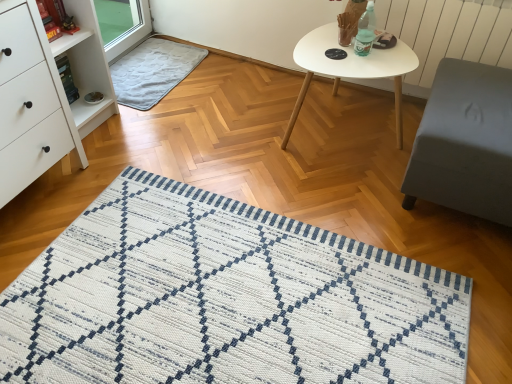
Image resolution: width=512 pixels, height=384 pixels. Find the location of `gray matte ottoman at right`. gray matte ottoman at right is located at coordinates (465, 142).

This screenshot has width=512, height=384. I want to click on white matte chest of drawers at left, so click(x=30, y=102).

What do you see at coordinates (30, 102) in the screenshot? I see `white matte chest of drawers at left` at bounding box center [30, 102].

Find the location of a particular element. The width and height of the screenshot is (512, 384). gray matte ottoman at right is located at coordinates (465, 142).

Does gray soft rug at upper left lie in front of white matte oval table at upper center?

No, it is behind white matte oval table at upper center.

Is gray soft rug at upper left to the left of white matte oval table at upper center from the viewer's perspective?

Correct, you'll find gray soft rug at upper left to the left of white matte oval table at upper center.

What's the angular difference between gray soft rug at upper left and white matte oval table at upper center's facing directions?

There is a 92.1-degree angle between the facing directions of gray soft rug at upper left and white matte oval table at upper center.

Is gray soft rug at upper left wider than white matte oval table at upper center?

Incorrect, the width of gray soft rug at upper left does not surpass that of white matte oval table at upper center.

Can you tell me how much translucent plastic bottle at upper right and white matte oval table at upper center differ in facing direction?

The facing directions of translucent plastic bottle at upper right and white matte oval table at upper center are 1.2 degrees apart.

Is translucent plastic bottle at upper right in front of white matte oval table at upper center?

No, translucent plastic bottle at upper right is further to the viewer.

What are the coordinates of `bottle above the white matte oval table at upper center (from the image's perspective)` in the screenshot? It's located at (365, 31).

From the image's perspective, would you say translucent plastic bottle at upper right is positioned over white matte oval table at upper center?

Yes, from the image's perspective, translucent plastic bottle at upper right is above white matte oval table at upper center.

Based on the photo, considering the relative sizes of white textured radiator at upper right and gray soft rug at upper left in the image provided, is white textured radiator at upper right shorter than gray soft rug at upper left?

No, white textured radiator at upper right is not shorter than gray soft rug at upper left.

From the image's perspective, which one is positioned higher, white textured radiator at upper right or gray soft rug at upper left?

gray soft rug at upper left appears higher in the image.

Looking at this image, is white textured radiator at upper right oriented away from gray soft rug at upper left?

white textured radiator at upper right is not turned away from gray soft rug at upper left.

Is white textured radiator at upper right placed right next to gray soft rug at upper left?

No, white textured radiator at upper right is not in contact with gray soft rug at upper left.

Between white textured radiator at upper right and gray matte ottoman at right, which one has less height?

white textured radiator at upper right is shorter.

Which object is positioned more to the right, white textured radiator at upper right or gray matte ottoman at right?

Positioned to the right is gray matte ottoman at right.

From a real-world perspective, who is located lower, white textured radiator at upper right or gray matte ottoman at right?

white textured radiator at upper right, from a real-world perspective.

From a real-world perspective, which is physically above, gray matte ottoman at right or gray soft rug at upper left?

gray matte ottoman at right.

Can you confirm if gray matte ottoman at right is bigger than gray soft rug at upper left?

Yes.

Is gray matte ottoman at right directly adjacent to gray soft rug at upper left?

No, gray matte ottoman at right is not beside gray soft rug at upper left.

From the image's perspective, between white matte chest of drawers at left and translucent plastic bottle at upper right, which one is located above?

translucent plastic bottle at upper right.

Could you measure the distance between white matte chest of drawers at left and translucent plastic bottle at upper right?

white matte chest of drawers at left and translucent plastic bottle at upper right are 1.39 meters apart from each other.

Is white matte chest of drawers at left to the right of translucent plastic bottle at upper right from the viewer's perspective?

No, white matte chest of drawers at left is not to the right of translucent plastic bottle at upper right.

Is white matte chest of drawers at left touching translucent plastic bottle at upper right?

They are not placed beside each other.

Is white matte chest of drawers at left taller than white textured radiator at upper right?

Yes, white matte chest of drawers at left is taller than white textured radiator at upper right.

Is white matte chest of drawers at left positioned far away from white textured radiator at upper right?

Yes.

Which is more to the right, white matte chest of drawers at left or white textured radiator at upper right?

white textured radiator at upper right.

This screenshot has height=384, width=512. I want to click on blanket directly beneath the white matte oval table at upper center (from a real-world perspective), so click(153, 71).

Identify the location of bottle that appears above the white matte oval table at upper center (from the image's perspective). (365, 31).

Based on their spatial positions, is white matte chest of drawers at left or white textured radiator at upper right further from translucent plastic bottle at upper right?

Among the two, white matte chest of drawers at left is located further to translucent plastic bottle at upper right.

Based on their spatial positions, is gray soft rug at upper left or white matte chest of drawers at left further from translucent plastic bottle at upper right?

white matte chest of drawers at left.

Looking at the image, which one is located closer to white matte oval table at upper center, gray soft rug at upper left or white matte chest of drawers at left?

gray soft rug at upper left lies closer to white matte oval table at upper center than the other object.

Considering their positions, is white textured radiator at upper right positioned closer to gray soft rug at upper left than white matte oval table at upper center?

The object closer to gray soft rug at upper left is white matte oval table at upper center.

Which object lies further to the anchor point white matte chest of drawers at left, gray matte ottoman at right or translucent plastic bottle at upper right?

Among the two, gray matte ottoman at right is located further to white matte chest of drawers at left.

Looking at the image, which one is located further to white matte chest of drawers at left, gray soft rug at upper left or white textured radiator at upper right?

white textured radiator at upper right lies further to white matte chest of drawers at left than the other object.

Based on their spatial positions, is gray soft rug at upper left or white matte chest of drawers at left further from gray matte ottoman at right?

gray soft rug at upper left is further to gray matte ottoman at right.

Looking at this image, which object lies nearer to the anchor point gray soft rug at upper left, gray matte ottoman at right or white matte chest of drawers at left?

white matte chest of drawers at left is positioned closer to the anchor gray soft rug at upper left.

Locate an element on the screen. radiator located between gray soft rug at upper left and gray matte ottoman at right in the left-right direction is located at coordinates (447, 34).

At what (x,y) coordinates should I click in order to perform the action: click on bottle situated between white matte chest of drawers at left and gray matte ottoman at right from left to right. Please return your answer as a coordinate pair (x, y). This screenshot has height=384, width=512. Looking at the image, I should click on pyautogui.click(x=365, y=31).

Where is `coffee table between gray soft rug at upper left and white textured radiator at upper right`? The height and width of the screenshot is (384, 512). coffee table between gray soft rug at upper left and white textured radiator at upper right is located at coordinates (350, 69).

Where is `radiator between white matte chest of drawers at left and gray matte ottoman at right in the horizontal direction`? The image size is (512, 384). radiator between white matte chest of drawers at left and gray matte ottoman at right in the horizontal direction is located at coordinates (447, 34).